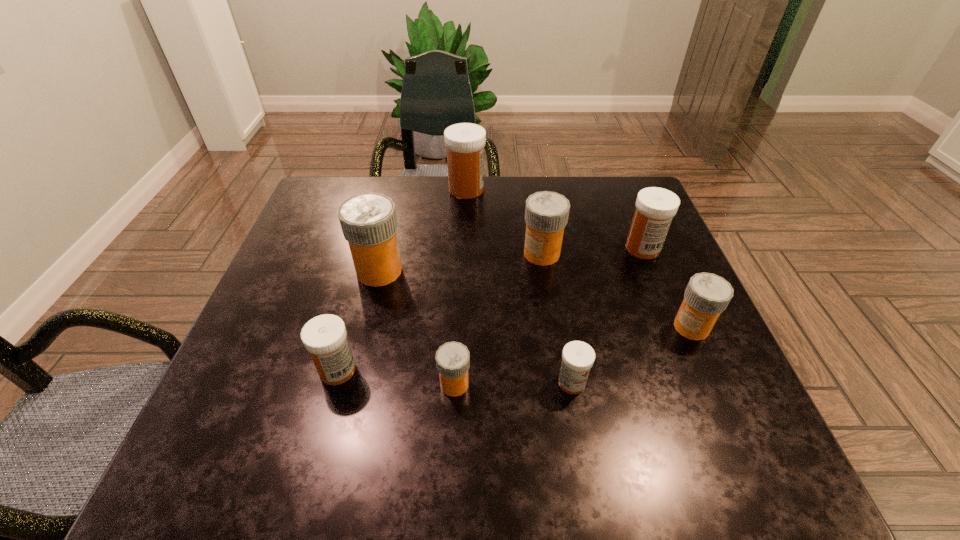
Find the location of a particular element. Image resolution: width=960 pixels, height=540 pixels. vacant space positioned 0.110m on the label side of the fifth farthest object is located at coordinates (620, 327).

The height and width of the screenshot is (540, 960). In order to click on vacant space located on the back of the leftmost white medicine in this screenshot , I will do `click(373, 239)`.

Identify the location of free space located on the label side of the third orange medicine from right to left. (566, 384).

Image resolution: width=960 pixels, height=540 pixels. In order to click on blank area located on the left of the second white medicine from right to left in this screenshot , I will do `click(515, 382)`.

This screenshot has height=540, width=960. In order to click on object positioned at the far edge in this screenshot , I will do `click(465, 142)`.

At what (x,y) coordinates should I click in order to perform the action: click on free space at the far edge. Please return your answer as a coordinate pair (x, y). This screenshot has height=540, width=960. Looking at the image, I should click on (422, 214).

Locate an element on the screen. This screenshot has height=540, width=960. free location at the near edge is located at coordinates (640, 430).

Image resolution: width=960 pixels, height=540 pixels. In the image, there is a desktop. Identify the location of vacant space at the left edge. (314, 258).

Locate an element on the screen. This screenshot has height=540, width=960. vacant space at the right edge is located at coordinates (660, 340).

In the image, there is a desktop. At what (x,y) coordinates should I click in order to perform the action: click on vacant space at the far right corner. Please return your answer as a coordinate pair (x, y). Looking at the image, I should click on (631, 219).